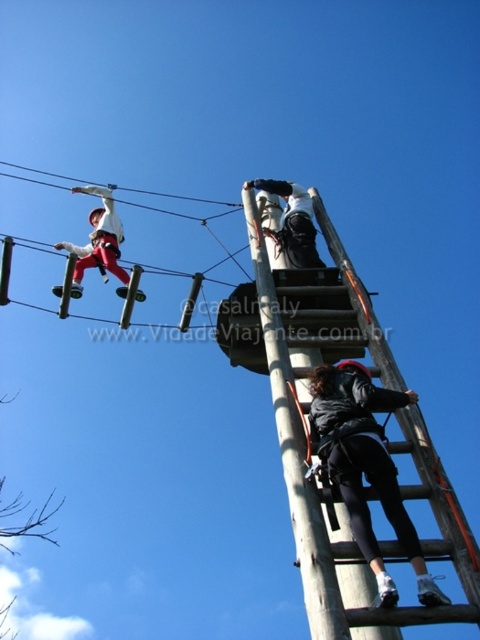
You are an observer at the obstacle course. You see the wooden ladder at center and the wooden pole at upper center. Which object is positioned more to the right side?

The wooden ladder at center is positioned more to the right side than the wooden pole at upper center.

You are a photographer trying to capture the best angle of the obstacle course. You notice two points marked in the image at coordinates point (312, 419) and point (278, 189). Which point is nearer to your camera lens?

Point (312, 419) is closer to the camera than point (278, 189).